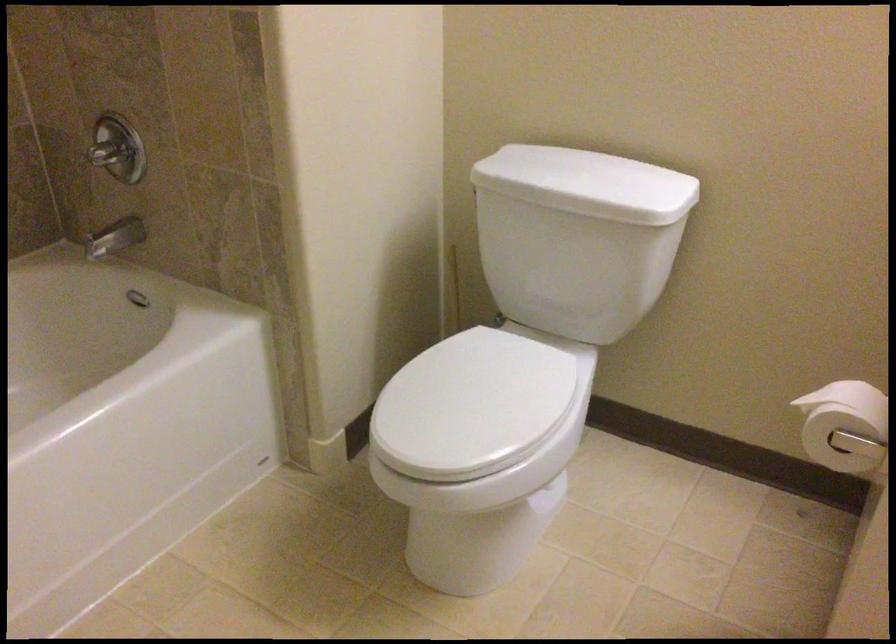
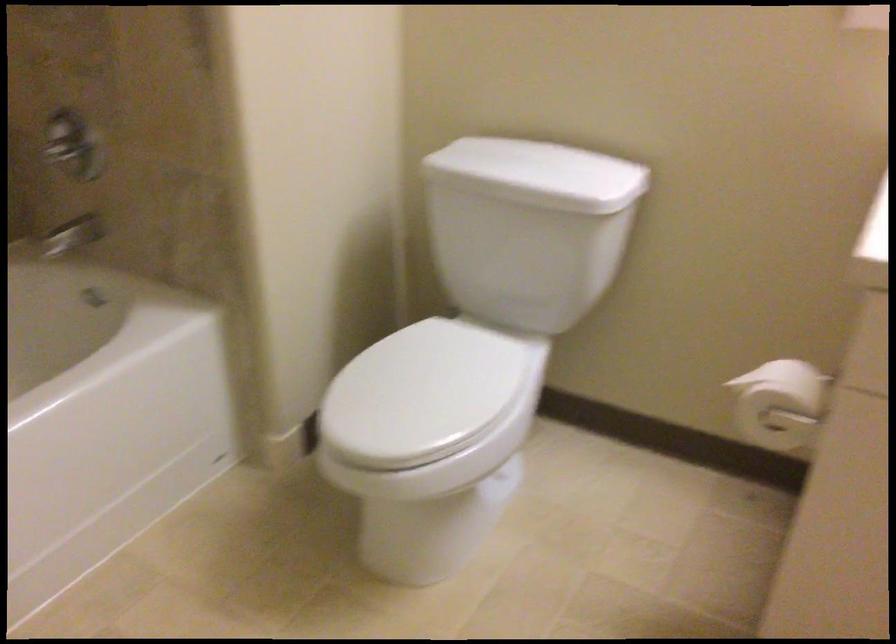
In a continuous first-person perspective shot, in which direction is the camera moving?

The cameraman moved toward right, backward.